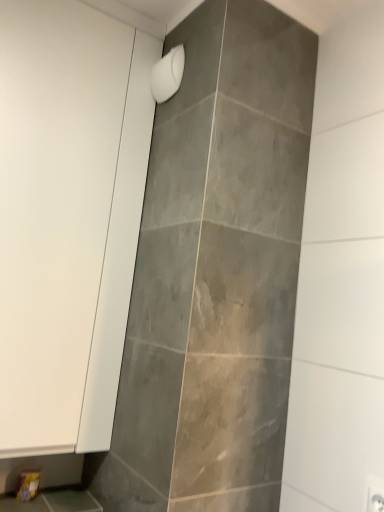
In order to face white matte cabinet at left, should I rotate leftwards or rightwards?

To face it directly, rotate left by 18.175 degrees.

Locate an element on the screen. white matte cabinet at left is located at coordinates (54, 208).

This screenshot has width=384, height=512. What do you see at coordinates (54, 208) in the screenshot?
I see `white matte cabinet at left` at bounding box center [54, 208].

At what (x,y) coordinates should I click in order to perform the action: click on white matte shower head at upper center. Please return your answer as a coordinate pair (x, y). This screenshot has height=512, width=384. Looking at the image, I should click on (167, 74).

Describe the element at coordinates (167, 74) in the screenshot. I see `white matte shower head at upper center` at that location.

Where is `white matte cabinet at left`? The width and height of the screenshot is (384, 512). white matte cabinet at left is located at coordinates coord(54,208).

Visually, is white matte cabinet at left positioned to the left or to the right of white matte shower head at upper center?

white matte cabinet at left is to the left of white matte shower head at upper center.

Which object is further away from the camera, white matte cabinet at left or white matte shower head at upper center?

white matte shower head at upper center is further away from the camera.

Considering the points (51, 152) and (184, 52), which point is behind, point (51, 152) or point (184, 52)?

The point (184, 52) is farther from the camera.

From the image's perspective, which one is positioned lower, white matte cabinet at left or white matte shower head at upper center?

white matte cabinet at left.

From a real-world perspective, who is located lower, white matte cabinet at left or white matte shower head at upper center?

From a 3D spatial view, white matte cabinet at left is below.

Can you confirm if white matte cabinet at left is thinner than white matte shower head at upper center?

In fact, white matte cabinet at left might be wider than white matte shower head at upper center.

Based on the photo, can you confirm if white matte cabinet at left is shorter than white matte shower head at upper center?

Incorrect, the height of white matte cabinet at left does not fall short of that of white matte shower head at upper center.

Considering the sizes of white matte cabinet at left and white matte shower head at upper center in the image, is white matte cabinet at left bigger or smaller than white matte shower head at upper center?

white matte cabinet at left is bigger than white matte shower head at upper center.

Is white matte cabinet at left not within white matte shower head at upper center?

Yes, white matte cabinet at left is outside of white matte shower head at upper center.

Is white matte cabinet at left placed right next to white matte shower head at upper center?

No, white matte cabinet at left is not beside white matte shower head at upper center.

Is white matte cabinet at left aimed at white matte shower head at upper center?

Yes, white matte cabinet at left is aimed at white matte shower head at upper center.

How many degrees apart are the facing directions of white matte cabinet at left and white matte shower head at upper center?

white matte cabinet at left and white matte shower head at upper center are facing 89.9 degrees away from each other.

Locate an element on the screen. The image size is (384, 512). shower on the right side of white matte cabinet at left is located at coordinates (167, 74).

Which is more to the left, white matte shower head at upper center or white matte cabinet at left?

Positioned to the left is white matte cabinet at left.

Looking at this image, between white matte shower head at upper center and white matte cabinet at left, which one is positioned behind?

Positioned behind is white matte shower head at upper center.

Does point (152, 71) come behind point (45, 73)?

Yes, it is.

From the image's perspective, is white matte shower head at upper center above or below white matte cabinet at left?

Clearly, from the image's perspective, white matte shower head at upper center is above white matte cabinet at left.

From a real-world perspective, who is located lower, white matte shower head at upper center or white matte cabinet at left?

From a 3D spatial view, white matte cabinet at left is below.

Which of these two, white matte shower head at upper center or white matte cabinet at left, is thinner?

white matte shower head at upper center is thinner.

Can you confirm if white matte shower head at upper center is shorter than white matte cabinet at left?

Yes.

Considering the sizes of white matte shower head at upper center and white matte cabinet at left in the image, is white matte shower head at upper center bigger or smaller than white matte cabinet at left?

white matte shower head at upper center is smaller than white matte cabinet at left.

In the scene shown: Do you think white matte shower head at upper center is within white matte cabinet at left, or outside of it?

The correct answer is: outside.

Are white matte shower head at upper center and white matte cabinet at left beside each other?

white matte shower head at upper center and white matte cabinet at left are clearly separated.

Is white matte shower head at upper center facing towards white matte cabinet at left?

No, white matte shower head at upper center does not turn towards white matte cabinet at left.

How different are the orientations of white matte shower head at upper center and white matte cabinet at left in degrees?

white matte shower head at upper center and white matte cabinet at left are facing 89.9 degrees away from each other.

Find the location of a particular element. This screenshot has width=384, height=512. shower behind the white matte cabinet at left is located at coordinates (167, 74).

Image resolution: width=384 pixels, height=512 pixels. I want to click on shower above the white matte cabinet at left (from the image's perspective), so click(x=167, y=74).

The width and height of the screenshot is (384, 512). Identify the location of screen door located underneath the white matte shower head at upper center (from a real-world perspective). click(54, 208).